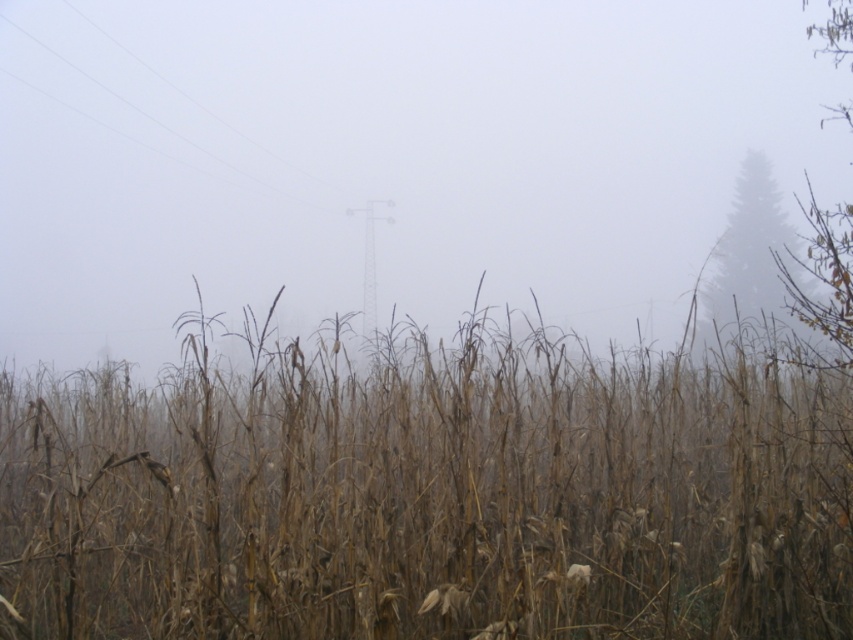
Question: Which is nearer to the clear wire at upper left?

Choices:
 (A) green matte tree at upper right
 (B) foggy atmosphere at center
 (C) brown dry grass at center

Answer: (B)

Question: Is green matte tree at upper right behind clear wire at upper left?

Choices:
 (A) yes
 (B) no

Answer: (B)

Question: Among these objects, which one is nearest to the camera?

Choices:
 (A) clear wire at upper left
 (B) brown dry grass at center

Answer: (B)

Question: Among these points, which one is farthest from the camera?

Choices:
 (A) (747, 244)
 (B) (492, 296)
 (C) (614, 397)

Answer: (B)

Question: Does brown dry grass at center have a smaller size compared to clear wire at upper left?

Choices:
 (A) yes
 (B) no

Answer: (A)

Question: Observing the image, what is the correct spatial positioning of green matte tree at upper right in reference to clear wire at upper left?

Choices:
 (A) below
 (B) above

Answer: (A)